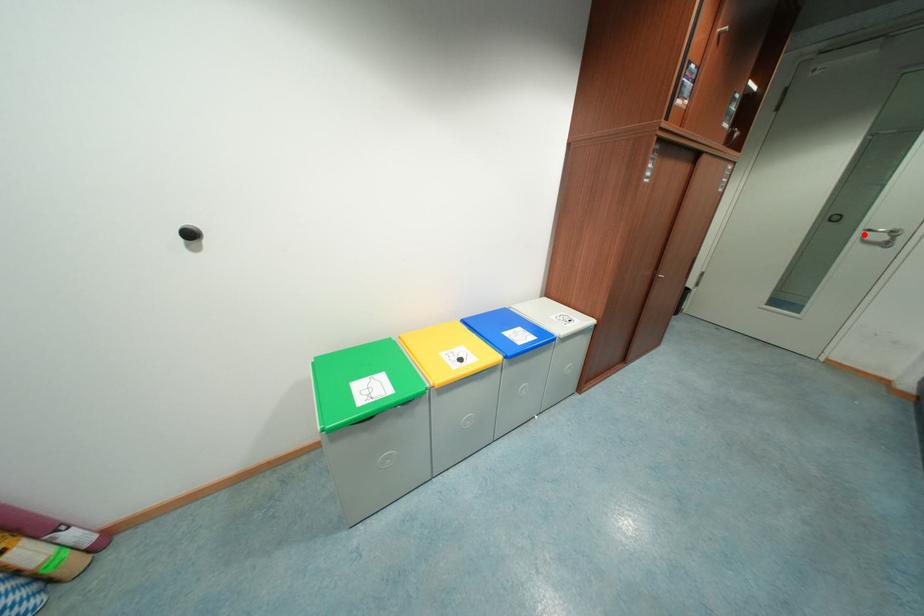
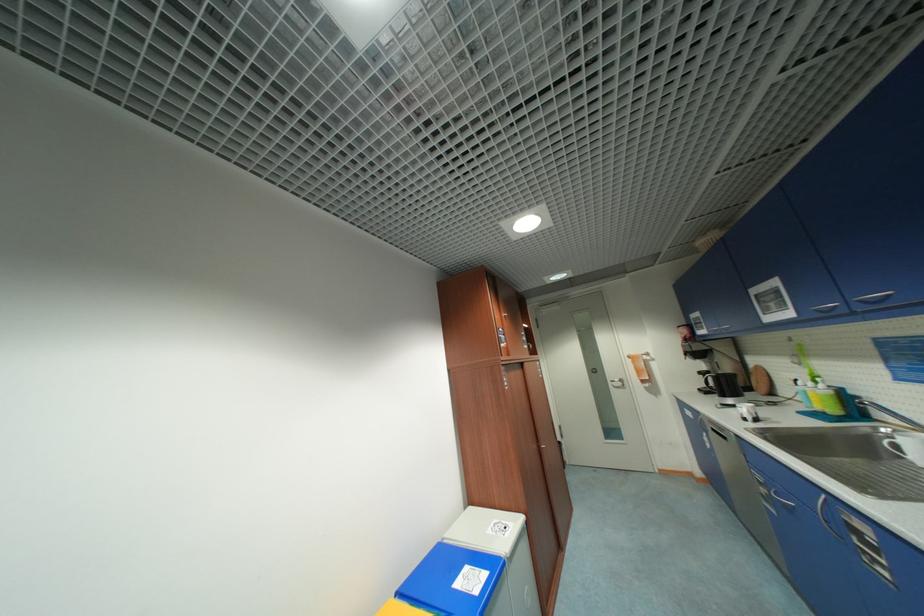
Find the pixel in the second image that matches the highlighted location in the first image.

(615, 384)